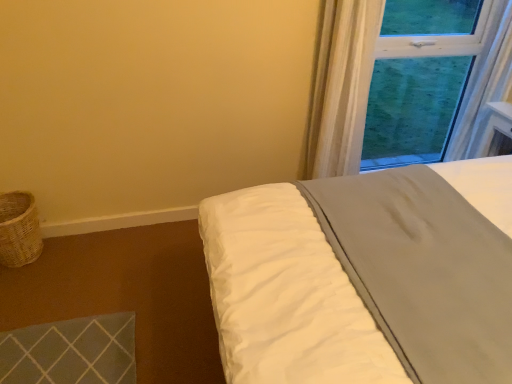
What is the approximate height of woven wicker basket at lower left?

woven wicker basket at lower left is 12.51 inches tall.

Measure the distance between point (14, 194) and camera.

They are 2.16 meters apart.

Describe the element at coordinates (341, 86) in the screenshot. The image size is (512, 384). I see `white sheer curtain at upper right` at that location.

Locate an element on the screen. The width and height of the screenshot is (512, 384). woven wicker basket at lower left is located at coordinates (19, 229).

Based on the photo, who is smaller, white soft bed at upper right or woven wicker basket at lower left?

Smaller between the two is woven wicker basket at lower left.

Considering the positions of point (279, 262) and point (25, 234), is point (279, 262) closer or farther from the camera than point (25, 234)?

Point (279, 262) is positioned closer to the camera compared to point (25, 234).

Does white soft bed at upper right lie in front of woven wicker basket at lower left?

Yes, it is.

Measure the distance from white soft bed at upper right to woven wicker basket at lower left.

4.43 feet.

Considering the sizes of white sheer curtain at upper right and white soft bed at upper right in the image, is white sheer curtain at upper right wider or thinner than white soft bed at upper right?

Considering their sizes, white sheer curtain at upper right looks slimmer than white soft bed at upper right.

From a real-world perspective, does white sheer curtain at upper right stand above white soft bed at upper right?

Indeed, from a real-world perspective, white sheer curtain at upper right stands above white soft bed at upper right.

Is the position of white sheer curtain at upper right less distant than that of white soft bed at upper right?

No, it is behind white soft bed at upper right.

Where is `curtain positioned vertically above the woven wicker basket at lower left (from a real-world perspective)`? The image size is (512, 384). curtain positioned vertically above the woven wicker basket at lower left (from a real-world perspective) is located at coordinates (341, 86).

Which object is positioned more to the right, white sheer curtain at upper right or woven wicker basket at lower left?

Positioned to the right is white sheer curtain at upper right.

From a real-world perspective, is white sheer curtain at upper right positioned above or below woven wicker basket at lower left?

In terms of real-world spatial position, white sheer curtain at upper right is above woven wicker basket at lower left.

Consider the image. How much distance is there between white sheer curtain at upper right and woven wicker basket at lower left?

white sheer curtain at upper right and woven wicker basket at lower left are 1.63 meters apart from each other.

Is woven wicker basket at lower left turned away from white sheer curtain at upper right?

woven wicker basket at lower left does not have its back to white sheer curtain at upper right.

Can we say woven wicker basket at lower left lies outside white sheer curtain at upper right?

Yes, woven wicker basket at lower left is located beyond the bounds of white sheer curtain at upper right.

In the scene shown: Looking at their sizes, would you say woven wicker basket at lower left is wider or thinner than white sheer curtain at upper right?

Considering their sizes, woven wicker basket at lower left looks broader than white sheer curtain at upper right.

Looking at the image, does woven wicker basket at lower left seem bigger or smaller compared to white sheer curtain at upper right?

Clearly, woven wicker basket at lower left is smaller in size than white sheer curtain at upper right.

Based on their sizes in the image, would you say woven wicker basket at lower left is bigger or smaller than white soft bed at upper right?

Considering their sizes, woven wicker basket at lower left takes up less space than white soft bed at upper right.

What's the angular difference between woven wicker basket at lower left and white soft bed at upper right's facing directions?

The angle between the facing direction of woven wicker basket at lower left and the facing direction of white soft bed at upper right is 178 degrees.

From a real-world perspective, is woven wicker basket at lower left located higher than white soft bed at upper right?

Incorrect, from a real-world perspective, woven wicker basket at lower left is lower than white soft bed at upper right.

Would you consider woven wicker basket at lower left to be distant from white soft bed at upper right?

That's right, there is a large distance between woven wicker basket at lower left and white soft bed at upper right.

Which is closer to the camera, (x=378, y=370) or (x=345, y=162)?

Point (x=378, y=370)

Which is behind, white soft bed at upper right or white sheer curtain at upper right?

white sheer curtain at upper right is more distant.

Is white soft bed at upper right not within white sheer curtain at upper right?

That's correct, white soft bed at upper right is outside of white sheer curtain at upper right.

At what (x,y) coordinates should I click in order to perform the action: click on basket behind the white soft bed at upper right. Please return your answer as a coordinate pair (x, y). Looking at the image, I should click on (19, 229).

This screenshot has width=512, height=384. I want to click on curtain above the white soft bed at upper right (from the image's perspective), so click(341, 86).

Considering their positions, is white soft bed at upper right positioned further to woven wicker basket at lower left than white sheer curtain at upper right?

white sheer curtain at upper right lies further to woven wicker basket at lower left than the other object.

Which object lies nearer to the anchor point white sheer curtain at upper right, woven wicker basket at lower left or white soft bed at upper right?

Among the two, white soft bed at upper right is located nearer to white sheer curtain at upper right.

From the image, which object appears to be farther from woven wicker basket at lower left, white sheer curtain at upper right or white soft bed at upper right?

white sheer curtain at upper right is further to woven wicker basket at lower left.

Estimate the real-world distances between objects in this image. Which object is closer to white soft bed at upper right, woven wicker basket at lower left or white sheer curtain at upper right?

The object closer to white soft bed at upper right is white sheer curtain at upper right.

Based on their spatial positions, is white sheer curtain at upper right or woven wicker basket at lower left further from white soft bed at upper right?

woven wicker basket at lower left.

Considering their positions, is white soft bed at upper right positioned further to white sheer curtain at upper right than woven wicker basket at lower left?

The object further to white sheer curtain at upper right is woven wicker basket at lower left.

Where is `curtain between woven wicker basket at lower left and white soft bed at upper right in the horizontal direction`? This screenshot has height=384, width=512. curtain between woven wicker basket at lower left and white soft bed at upper right in the horizontal direction is located at coordinates (341, 86).